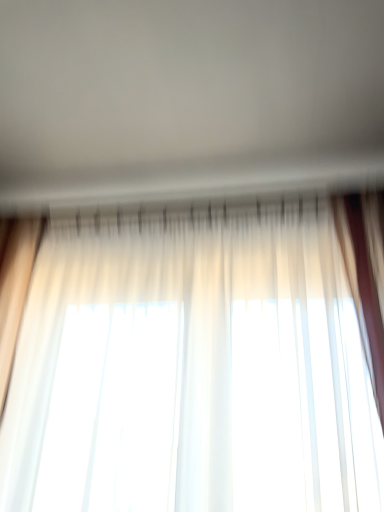
Question: Is sheer white curtain at center in front of or behind white sheer curtains at center in the image?

Choices:
 (A) behind
 (B) front

Answer: (A)

Question: Would you say sheer white curtain at center is to the left or to the right of white sheer curtains at center in the picture?

Choices:
 (A) right
 (B) left

Answer: (A)

Question: From their relative heights in the image, would you say sheer white curtain at center is taller or shorter than white sheer curtains at center?

Choices:
 (A) short
 (B) tall

Answer: (B)

Question: Based on their positions, is white sheer curtains at center located to the left or right of sheer white curtain at center?

Choices:
 (A) left
 (B) right

Answer: (A)

Question: In terms of size, does white sheer curtains at center appear bigger or smaller than sheer white curtain at center?

Choices:
 (A) small
 (B) big

Answer: (A)

Question: In terms of width, does white sheer curtains at center look wider or thinner when compared to sheer white curtain at center?

Choices:
 (A) wide
 (B) thin

Answer: (A)

Question: From a real-world perspective, is white sheer curtains at center physically located above or below sheer white curtain at center?

Choices:
 (A) below
 (B) above

Answer: (B)